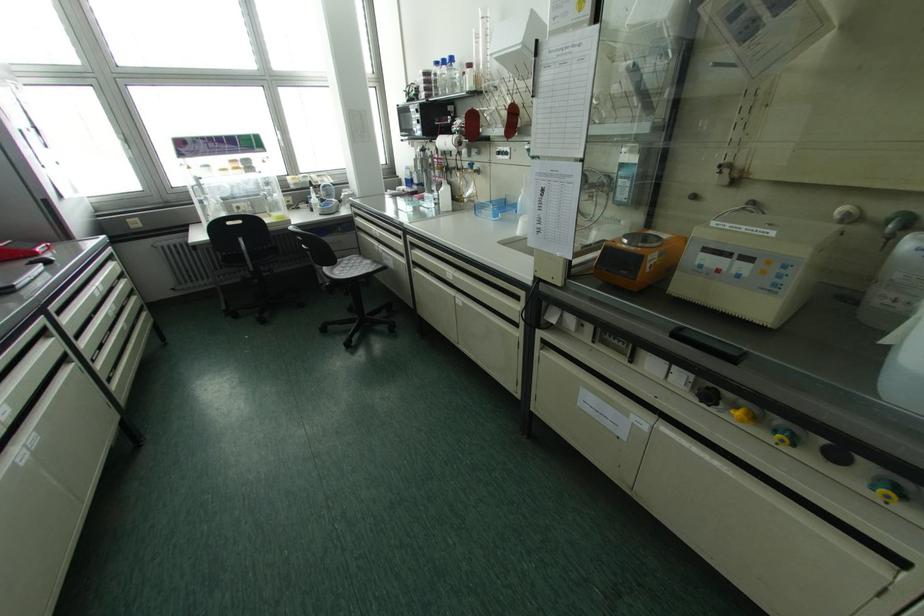
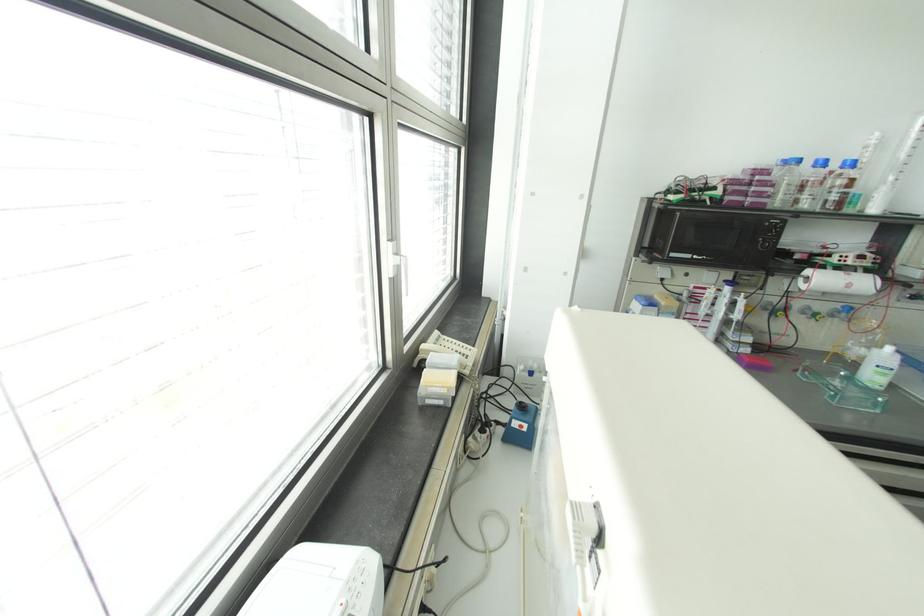
The point at (469, 164) is marked in the first image. Where is the corresponding point in the second image?

(848, 309)